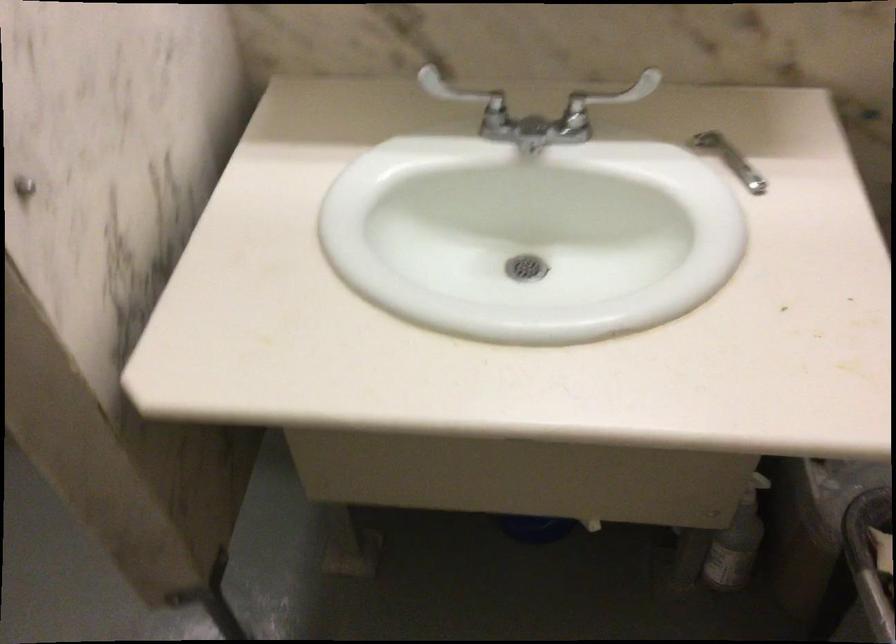
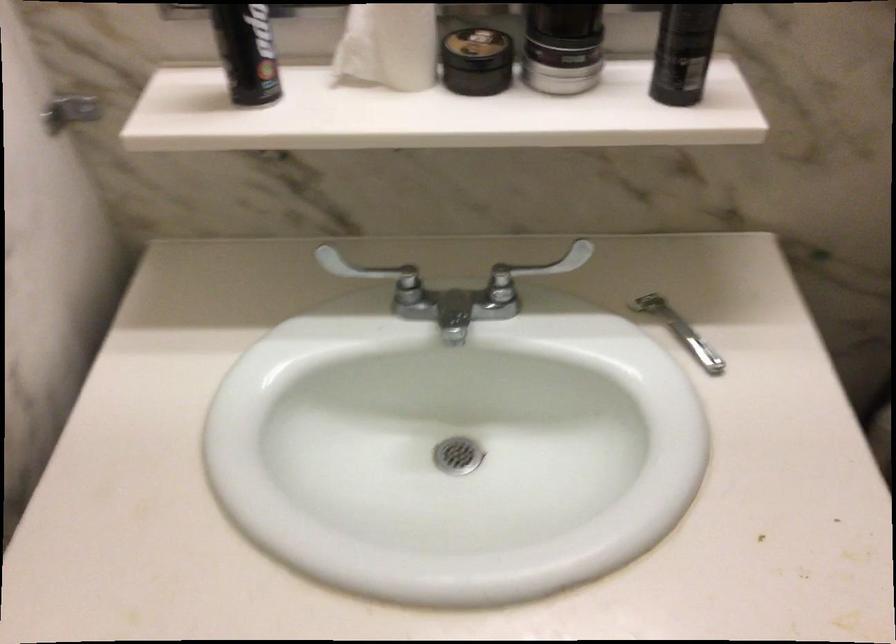
Question: The camera is either moving clockwise (left) or counter-clockwise (right) around the object. The first image is from the beginning of the video and the second image is from the end. Is the camera moving left or right when shooting the video?

Choices:
 (A) Left
 (B) Right

Answer: (A)